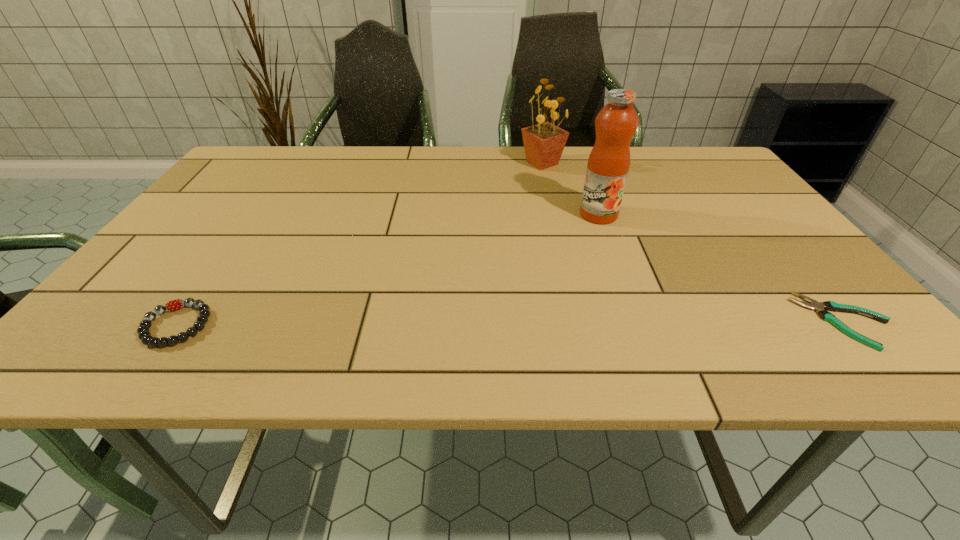
Where is `free space that is in between the tallest object and the third shortest object`? free space that is in between the tallest object and the third shortest object is located at coordinates (570, 189).

The height and width of the screenshot is (540, 960). I want to click on vacant space that's between the second farthest object and the third tallest object, so click(x=388, y=270).

Image resolution: width=960 pixels, height=540 pixels. Find the location of `free space between the shortest object and the farthest object`. free space between the shortest object and the farthest object is located at coordinates (693, 242).

At what (x,y) coordinates should I click in order to perform the action: click on vacant area that lies between the rightmost object and the bracelet. Please return your answer as a coordinate pair (x, y). Looking at the image, I should click on (511, 323).

The width and height of the screenshot is (960, 540). I want to click on free space between the fruit juice and the shortest object, so click(x=722, y=268).

Where is `empty location between the bracelet and the sunflower`? empty location between the bracelet and the sunflower is located at coordinates (359, 244).

You are a GUI agent. You are given a task and a screenshot of the screen. Output one action in this format:
    pyautogui.click(x=<x>, y=<y>)
    Task: Click on the vacant space in between the third tallest object and the tallest object
    
    Given the screenshot: What is the action you would take?
    pyautogui.click(x=388, y=270)

You are a GUI agent. You are given a task and a screenshot of the screen. Output one action in this format:
    pyautogui.click(x=<x>, y=<y>)
    Task: Click on the unoccupied area between the fruit juice and the bracelet
    
    Given the screenshot: What is the action you would take?
    pyautogui.click(x=388, y=270)

Choose which object is the second nearest neighbor to the second shortest object. Please provide its 2D coordinates. Your answer should be formatted as a tuple, i.e. [(x, y)], where the tuple contains the x and y coordinates of a point satisfying the conditions above.

[(544, 143)]

Identify which object is the second nearest to the tallest object. Please provide its 2D coordinates. Your answer should be formatted as a tuple, i.e. [(x, y)], where the tuple contains the x and y coordinates of a point satisfying the conditions above.

[(814, 305)]